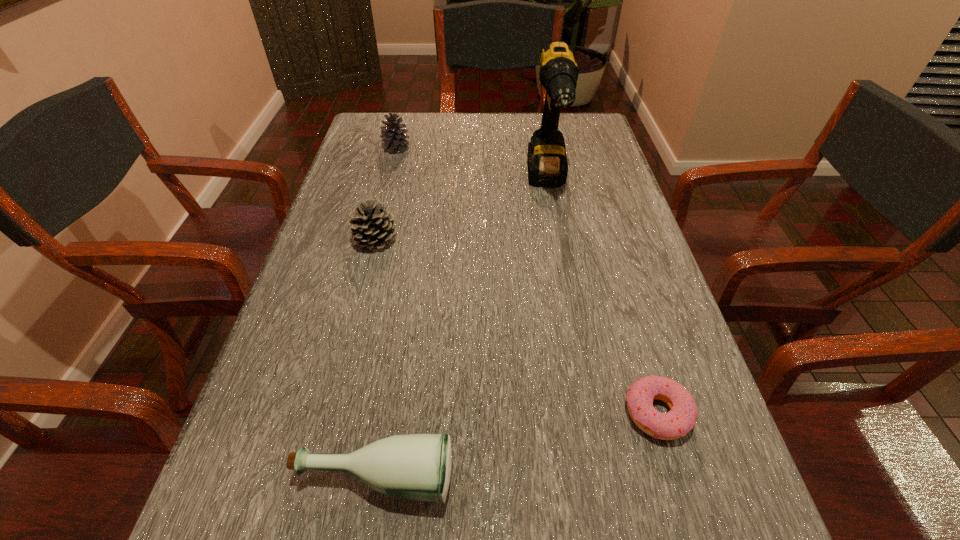
The height and width of the screenshot is (540, 960). What are the coordinates of `empty space that is in between the fourth farthest object and the drill` in the screenshot? It's located at (602, 297).

Locate an element on the screen. free area in between the farther pinecone and the doughnut is located at coordinates (527, 280).

Locate which object is the fourth closest to the drill. Please provide its 2D coordinates. Your answer should be formatted as a tuple, i.e. [(x, y)], where the tuple contains the x and y coordinates of a point satisfying the conditions above.

[(418, 466)]

At what (x,y) coordinates should I click in order to perform the action: click on object that stands as the third closest to the doughnut. Please return your answer as a coordinate pair (x, y). Image resolution: width=960 pixels, height=540 pixels. Looking at the image, I should click on (373, 227).

This screenshot has width=960, height=540. Find the location of `vacant space that satisfies the following two spatial constraints: 1. at the tip of the shortest object; 2. on the left side of the tallest object`. vacant space that satisfies the following two spatial constraints: 1. at the tip of the shortest object; 2. on the left side of the tallest object is located at coordinates (590, 413).

At what (x,y) coordinates should I click in order to perform the action: click on vacant space that satisfies the following two spatial constraints: 1. on the front side of the bottle; 2. on the left side of the farther pinecone. Please return your answer as a coordinate pair (x, y). Image resolution: width=960 pixels, height=540 pixels. Looking at the image, I should click on pos(313,477).

The width and height of the screenshot is (960, 540). Identify the location of free space that satisfies the following two spatial constraints: 1. on the front side of the second nearest object; 2. on the left side of the third nearest object. (333, 413).

Find the location of a particular element. vacant region that satisfies the following two spatial constraints: 1. at the tip of the second object from right to left; 2. on the left side of the rightmost object is located at coordinates (590, 413).

This screenshot has width=960, height=540. In order to click on free space that satisfies the following two spatial constraints: 1. at the tip of the rightmost object; 2. on the right side of the fourth object from left to right in this screenshot , I will do `click(590, 413)`.